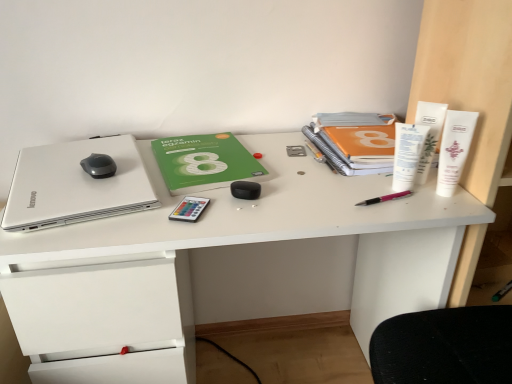
This screenshot has width=512, height=384. Find the location of `blank space to the left of orange matte notebook at upper right, acting as the 1th paperback book starting from the right`. blank space to the left of orange matte notebook at upper right, acting as the 1th paperback book starting from the right is located at coordinates (271, 152).